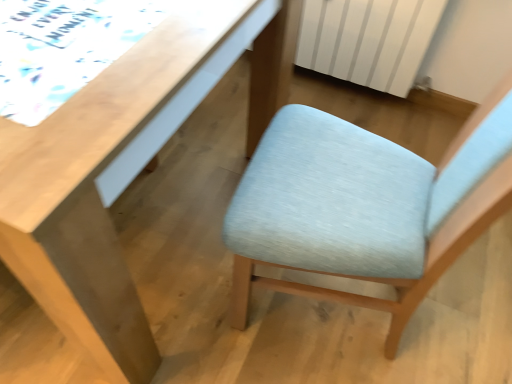
Question: From the image's perspective, relative to light blue fabric chair at center, is light wood desk at upper left above or below?

Choices:
 (A) below
 (B) above

Answer: (B)

Question: Relative to light blue fabric chair at center, is light wood desk at upper left in front or behind?

Choices:
 (A) front
 (B) behind

Answer: (B)

Question: Which of these objects is positioned closest to the light blue fabric chair at center?

Choices:
 (A) light wood desk at upper left
 (B) white striped radiator at upper right

Answer: (A)

Question: Which is farther from the white striped radiator at upper right?

Choices:
 (A) light wood desk at upper left
 (B) light blue fabric chair at center

Answer: (A)